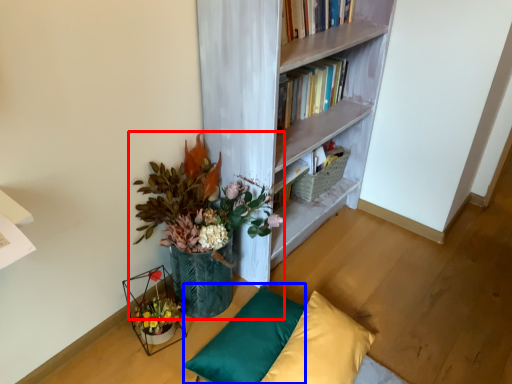
Question: Which of the following is the farthest to the observer, houseplant (highlighted by a red box) or pillow (highlighted by a blue box)?

Choices:
 (A) houseplant
 (B) pillow

Answer: (B)